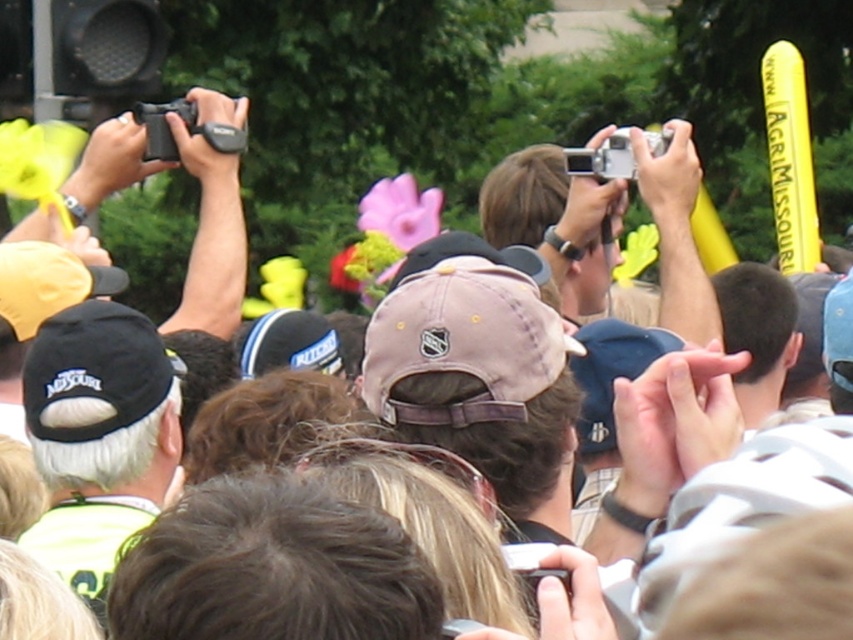
Question: Is light brown fabric baseball cap at center wider than black fabric cap at left?

Choices:
 (A) no
 (B) yes

Answer: (B)

Question: In this image, where is light brown fabric baseball cap at center located relative to black fabric cap at left?

Choices:
 (A) below
 (B) above

Answer: (B)

Question: Which of the following is the closest to the observer?

Choices:
 (A) click(85, 321)
 (B) click(457, 438)

Answer: (B)

Question: Observing the image, what is the correct spatial positioning of light brown fabric baseball cap at center in reference to black fabric cap at left?

Choices:
 (A) left
 (B) right

Answer: (B)

Question: Among these objects, which one is farthest from the camera?

Choices:
 (A) black fabric cap at left
 (B) light brown fabric baseball cap at center

Answer: (B)